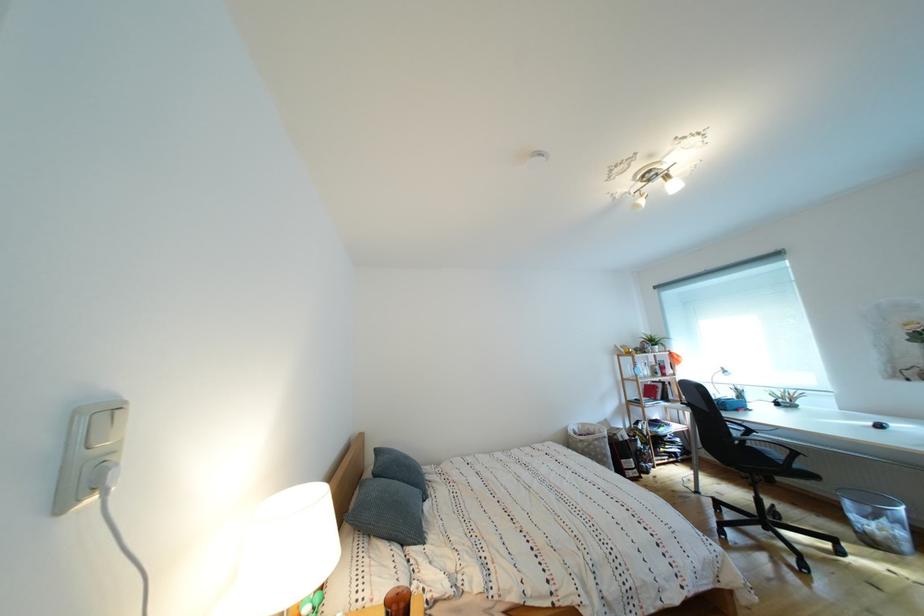
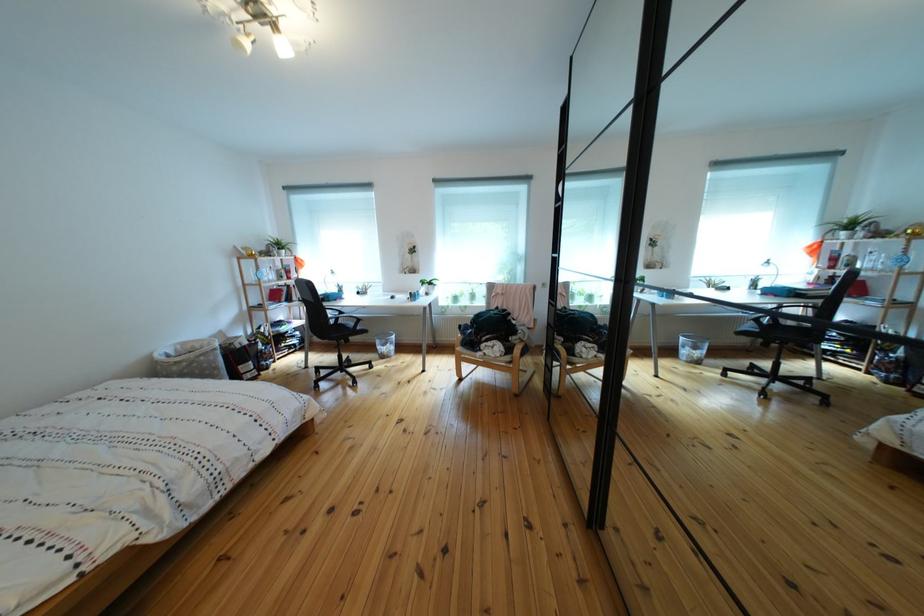
In the second image, find the point that corresponds to (x=657, y=383) in the first image.

(282, 286)